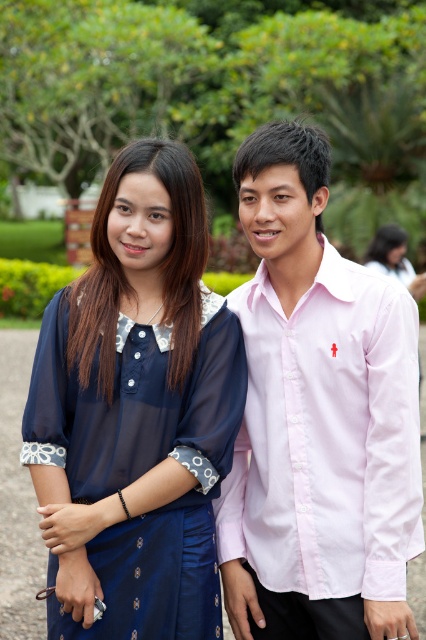
Question: In this image, where is pink cotton shirt at center located relative to navy sheer dress at center?

Choices:
 (A) above
 (B) below

Answer: (A)

Question: Can you confirm if pink cotton shirt at center is wider than navy sheer dress at center?

Choices:
 (A) yes
 (B) no

Answer: (B)

Question: Does pink cotton shirt at center appear over navy sheer dress at center?

Choices:
 (A) yes
 (B) no

Answer: (A)

Question: Among these points, which one is nearest to the camera?

Choices:
 (A) (232, 564)
 (B) (186, 509)

Answer: (B)